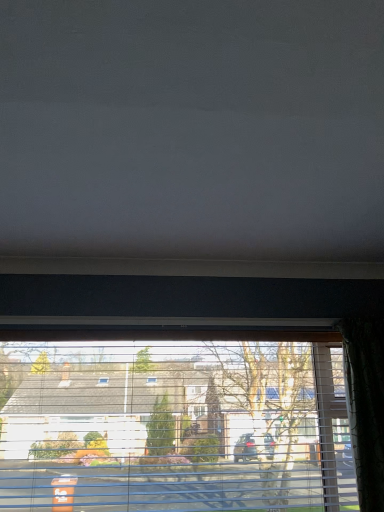
Question: Is transparent plastic window at center smaller than matte gray blind at upper center?

Choices:
 (A) no
 (B) yes

Answer: (B)

Question: Can you confirm if transparent plastic window at center is positioned to the right of matte gray blind at upper center?

Choices:
 (A) yes
 (B) no

Answer: (B)

Question: From the image's perspective, is transparent plastic window at center on top of matte gray blind at upper center?

Choices:
 (A) no
 (B) yes

Answer: (A)

Question: From a real-world perspective, is transparent plastic window at center physically below matte gray blind at upper center?

Choices:
 (A) no
 (B) yes

Answer: (B)

Question: From a real-world perspective, is transparent plastic window at center located higher than matte gray blind at upper center?

Choices:
 (A) yes
 (B) no

Answer: (B)

Question: From the image's perspective, is transparent plastic window at center beneath matte gray blind at upper center?

Choices:
 (A) no
 (B) yes

Answer: (B)

Question: Considering the relative sizes of matte gray blind at upper center and transparent plastic window at center in the image provided, is matte gray blind at upper center wider than transparent plastic window at center?

Choices:
 (A) yes
 (B) no

Answer: (A)

Question: Is transparent plastic window at center completely or partially inside matte gray blind at upper center?

Choices:
 (A) yes
 (B) no

Answer: (B)

Question: Considering the relative sizes of matte gray blind at upper center and transparent plastic window at center in the image provided, is matte gray blind at upper center bigger than transparent plastic window at center?

Choices:
 (A) yes
 (B) no

Answer: (A)

Question: Is matte gray blind at upper center facing away from transparent plastic window at center?

Choices:
 (A) no
 (B) yes

Answer: (A)

Question: Is matte gray blind at upper center shorter than transparent plastic window at center?

Choices:
 (A) no
 (B) yes

Answer: (B)

Question: Is matte gray blind at upper center far from transparent plastic window at center?

Choices:
 (A) yes
 (B) no

Answer: (A)

Question: Is point (238, 10) positioned closer to the camera than point (18, 501)?

Choices:
 (A) closer
 (B) farther

Answer: (A)